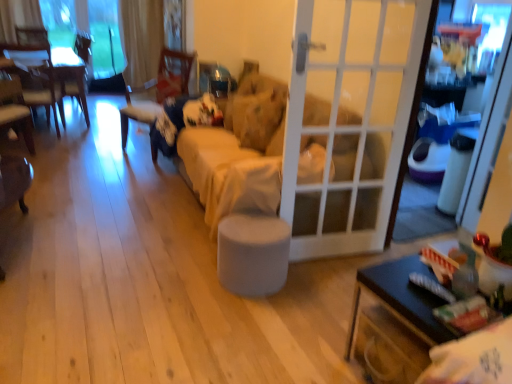
Question: Can we say black glossy table at lower right, the 1th table from the bottom, lies outside wooden chair at left, which is the 2th chair in right-to-left order?

Choices:
 (A) no
 (B) yes

Answer: (B)

Question: Is black glossy table at lower right, positioned as the second table in back-to-front order, at the left side of wooden chair at left, the 1th chair in the left-to-right sequence?

Choices:
 (A) yes
 (B) no

Answer: (B)

Question: Can you confirm if black glossy table at lower right, which is the 2th table in left-to-right order, is wider than wooden chair at left, the 1th chair in the left-to-right sequence?

Choices:
 (A) no
 (B) yes

Answer: (B)

Question: Is black glossy table at lower right, the 1th table in the right-to-left sequence, shorter than wooden chair at left, which is the 2th chair in right-to-left order?

Choices:
 (A) no
 (B) yes

Answer: (B)

Question: Does black glossy table at lower right, arranged as the second table when viewed from the top, have a greater height compared to wooden chair at left, which is the 2th chair in right-to-left order?

Choices:
 (A) no
 (B) yes

Answer: (A)

Question: Is black glossy table at lower right, positioned as the second table in back-to-front order, bigger than wooden chair at left, which is the 2th chair in right-to-left order?

Choices:
 (A) no
 (B) yes

Answer: (A)

Question: Does transparent glass window at upper left have a lesser width compared to white glass door at center?

Choices:
 (A) no
 (B) yes

Answer: (B)

Question: Is white glass door at center located within transparent glass window at upper left?

Choices:
 (A) no
 (B) yes

Answer: (A)

Question: From the image's perspective, does transparent glass window at upper left appear lower than white glass door at center?

Choices:
 (A) yes
 (B) no

Answer: (B)

Question: Is transparent glass window at upper left with white glass door at center?

Choices:
 (A) yes
 (B) no

Answer: (B)

Question: Is transparent glass window at upper left not close to white glass door at center?

Choices:
 (A) yes
 (B) no

Answer: (A)

Question: From a real-world perspective, is transparent glass window at upper left over white glass door at center?

Choices:
 (A) yes
 (B) no

Answer: (A)

Question: Is beige fabric couch at center beside black glossy table at lower right, positioned as the second table in back-to-front order?

Choices:
 (A) no
 (B) yes

Answer: (A)